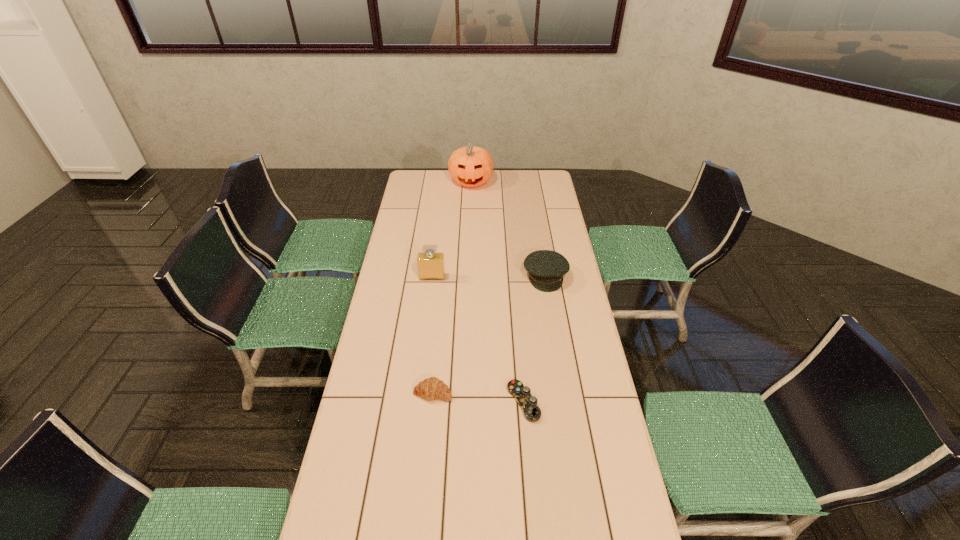
What are the coordinates of `vacant region located on the back of the shortest object` in the screenshot? It's located at (516, 322).

The width and height of the screenshot is (960, 540). Find the location of `object located at the far edge`. object located at the far edge is located at coordinates (470, 166).

Find the location of a particular element. object located in the left edge section of the desktop is located at coordinates (431, 264).

At what (x,y) coordinates should I click in order to perform the action: click on object that is at the right edge. Please return your answer as a coordinate pair (x, y). This screenshot has height=540, width=960. Looking at the image, I should click on (546, 268).

At what (x,y) coordinates should I click in order to perform the action: click on free space at the far edge. Please return your answer as a coordinate pair (x, y). The height and width of the screenshot is (540, 960). Looking at the image, I should click on (494, 190).

In the image, there is a desktop. At what (x,y) coordinates should I click in order to perform the action: click on free space at the left edge. Please return your answer as a coordinate pair (x, y). The image size is (960, 540). Looking at the image, I should click on (417, 287).

You are a GUI agent. You are given a task and a screenshot of the screen. Output one action in this format:
    pyautogui.click(x=<x>, y=<y>)
    Task: Click on the vacant space at the right edge of the desktop
    This screenshot has height=540, width=960.
    Given the screenshot: What is the action you would take?
    pyautogui.click(x=555, y=244)

Image resolution: width=960 pixels, height=540 pixels. What are the coordinates of `vacant space at the far left corner of the desktop` in the screenshot? It's located at (414, 184).

Where is `vacant space at the far right corner`? The height and width of the screenshot is (540, 960). vacant space at the far right corner is located at coordinates (547, 184).

Locate an element on the screen. This screenshot has width=960, height=540. blank region between the third tallest object and the second tallest object is located at coordinates (489, 276).